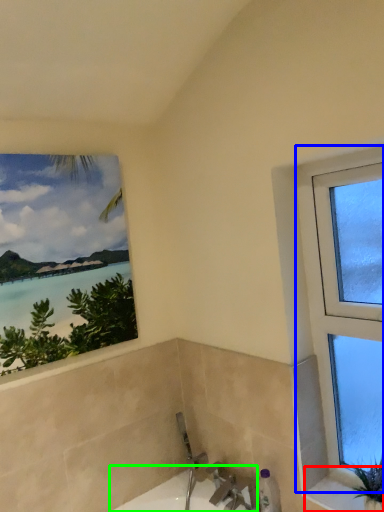
Question: Which is nearer to the window sill (highlighted by a red box)? window (highlighted by a blue box) or bath (highlighted by a green box).

Choices:
 (A) window
 (B) bath

Answer: (A)